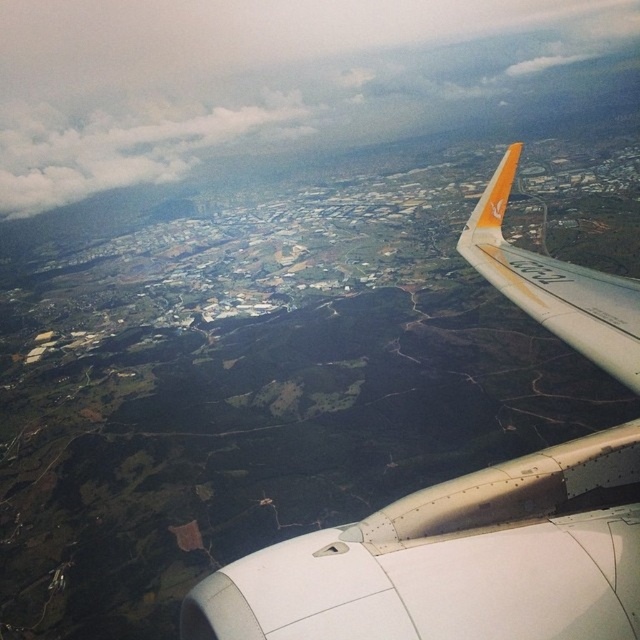
Question: Is white fluffy cloud at upper left below orange matte winglet at upper right?

Choices:
 (A) yes
 (B) no

Answer: (B)

Question: Based on their relative distances, which object is nearer to the white fluffy cloud at upper left?

Choices:
 (A) white fluffy cloud at upper center
 (B) orange matte winglet at upper right

Answer: (A)

Question: Estimate the real-world distances between objects in this image. Which object is farther from the white matte airplane wing at upper right?

Choices:
 (A) orange matte winglet at upper right
 (B) white fluffy cloud at upper left

Answer: (B)

Question: Does white fluffy cloud at upper center come in front of white fluffy cloud at upper left?

Choices:
 (A) yes
 (B) no

Answer: (A)

Question: Based on their relative distances, which object is nearer to the white fluffy cloud at upper left?

Choices:
 (A) white fluffy cloud at upper center
 (B) orange matte winglet at upper right

Answer: (A)

Question: Is white fluffy cloud at upper center bigger than white matte airplane wing at upper right?

Choices:
 (A) no
 (B) yes

Answer: (B)